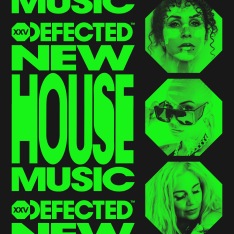
Find the location of a particular element. The width and height of the screenshot is (234, 234). poster is located at coordinates (148, 77).